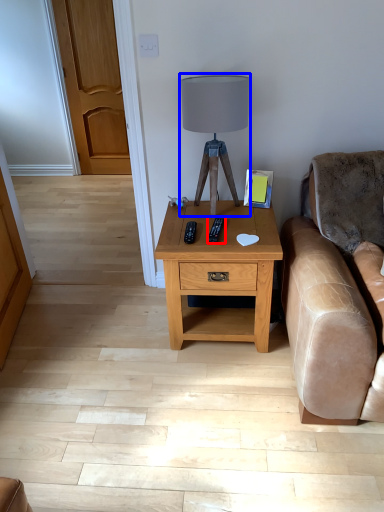
Question: Among these objects, which one is farthest to the camera, remote (highlighted by a red box) or table lamp (highlighted by a blue box)?

Choices:
 (A) remote
 (B) table lamp

Answer: (A)